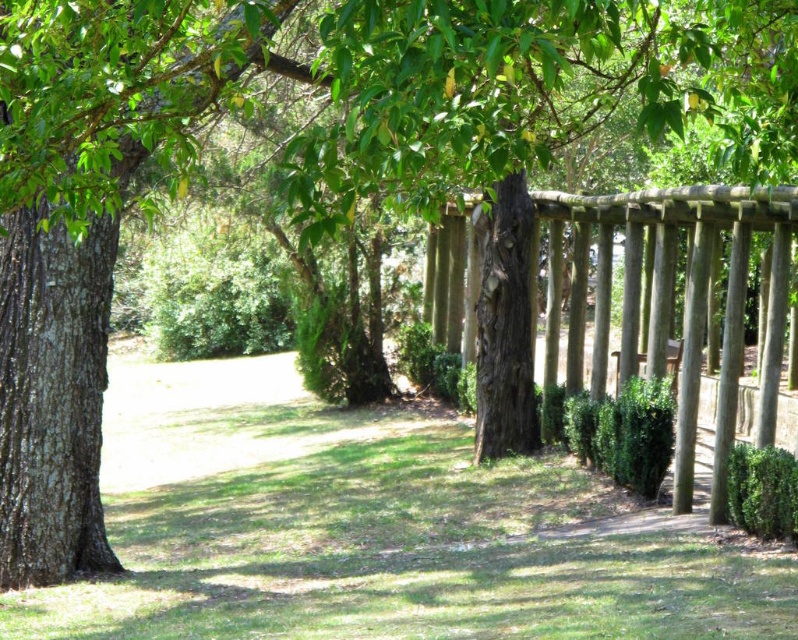
Question: Which object is farther from the camera taking this photo?

Choices:
 (A) green grass at center
 (B) wooden bench at center

Answer: (B)

Question: Is green grass at center smaller than green leafy hedge at center?

Choices:
 (A) no
 (B) yes

Answer: (A)

Question: Which object is the closest to the green grass at center?

Choices:
 (A) green leafy hedge at center
 (B) green leafy hedge at lower right

Answer: (B)

Question: Is green grass at center thinner than wooden bench at center?

Choices:
 (A) yes
 (B) no

Answer: (B)

Question: Which object is positioned farthest from the green leafy hedge at lower right?

Choices:
 (A) green leafy hedge at center
 (B) wooden bench at center
 (C) green grass at center

Answer: (B)

Question: Can you confirm if green grass at center is positioned to the left of green leafy hedge at lower right?

Choices:
 (A) yes
 (B) no

Answer: (A)